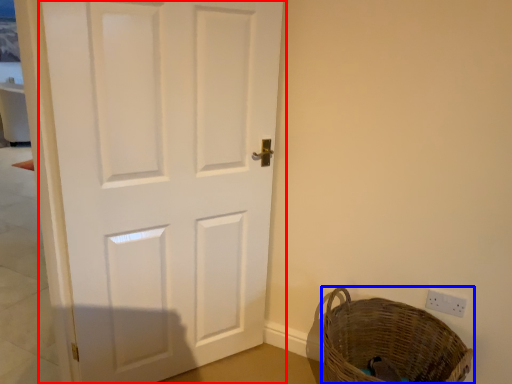
Question: Which object appears closest to the camera in this image, door (highlighted by a red box) or basket (highlighted by a blue box)?

Choices:
 (A) door
 (B) basket

Answer: (A)